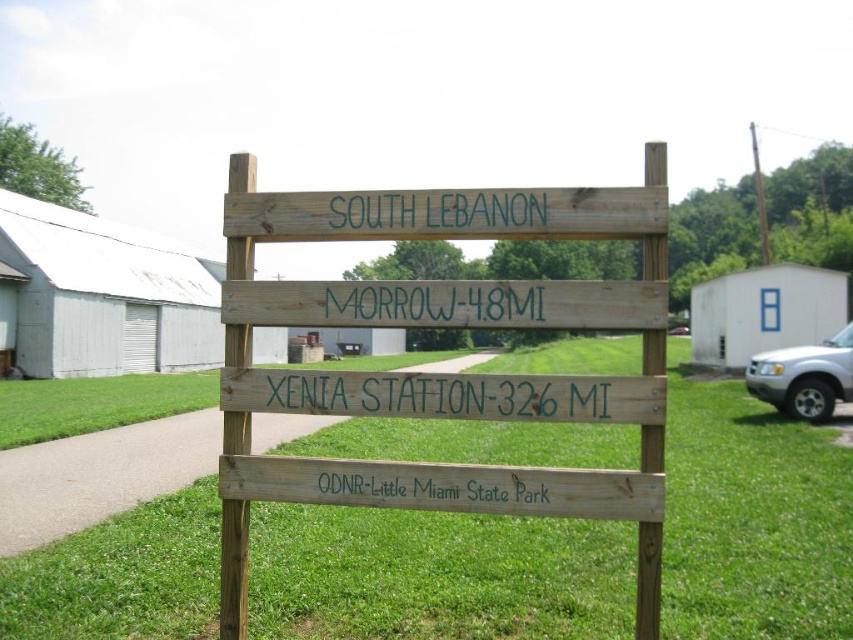
Can you confirm if green grass at center is taller than green wood sign at center?

Indeed, green grass at center has a greater height compared to green wood sign at center.

Is green grass at center closer to the viewer compared to green wood sign at center?

Yes, green grass at center is in front of green wood sign at center.

Between point (608, 433) and point (447, 282), which one is positioned behind?

The point (608, 433) is behind.

This screenshot has height=640, width=853. I want to click on green grass at center, so click(x=436, y=576).

Between point (352, 413) and point (399, 387), which one is positioned in front?

Point (399, 387) is more forward.

Who is more forward, (236,627) or (573,406)?

Positioned in front is point (573,406).

You are a GUI agent. You are given a task and a screenshot of the screen. Output one action in this format:
    pyautogui.click(x=<x>, y=<y>)
    Task: Click on the natural wood sign at center
    
    Given the screenshot: What is the action you would take?
    pyautogui.click(x=444, y=376)

Can you confirm if green painted wood sign at center is shorter than green painted wood sign at upper center?

No, green painted wood sign at center is not shorter than green painted wood sign at upper center.

Is green painted wood sign at center taller than green painted wood sign at upper center?

Indeed, green painted wood sign at center has a greater height compared to green painted wood sign at upper center.

The height and width of the screenshot is (640, 853). In order to click on green painted wood sign at center in this screenshot , I will do `click(442, 394)`.